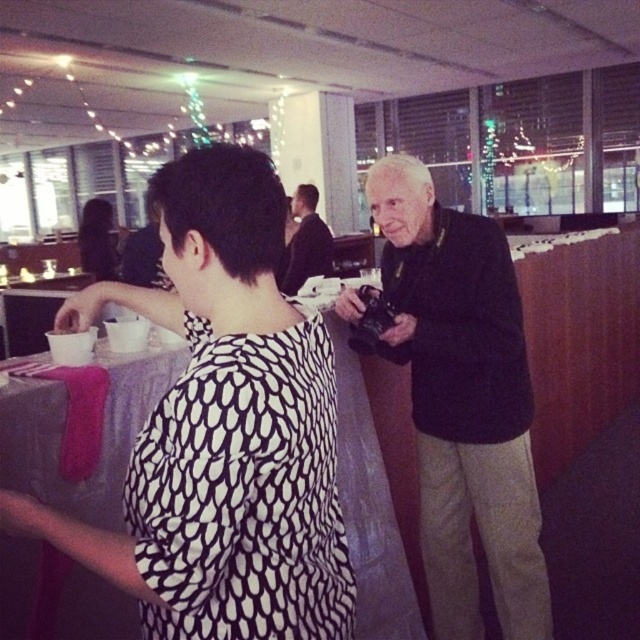
Question: Considering the real-world distances, which object is farthest from the matte black hair at upper left?

Choices:
 (A) white paper cup at left
 (B) black smooth suit at center
 (C) black printed shirt at center
 (D) black matte jacket at center

Answer: (C)

Question: Can you confirm if black matte jacket at center is wider than white paper cup at left?

Choices:
 (A) no
 (B) yes

Answer: (A)

Question: Which point is farther to the camera?

Choices:
 (A) black matte jacket at center
 (B) matte black hair at upper left
 (C) white paper cup at left
 (D) black printed shirt at center

Answer: (B)

Question: Can you confirm if black printed shirt at center is smaller than white paper cup at left?

Choices:
 (A) no
 (B) yes

Answer: (A)

Question: Among these objects, which one is farthest from the camera?

Choices:
 (A) matte black hair at upper left
 (B) black printed shirt at center
 (C) black matte jacket at center
 (D) black smooth suit at center

Answer: (A)

Question: Is black printed shirt at center smaller than matte black hair at upper left?

Choices:
 (A) yes
 (B) no

Answer: (A)